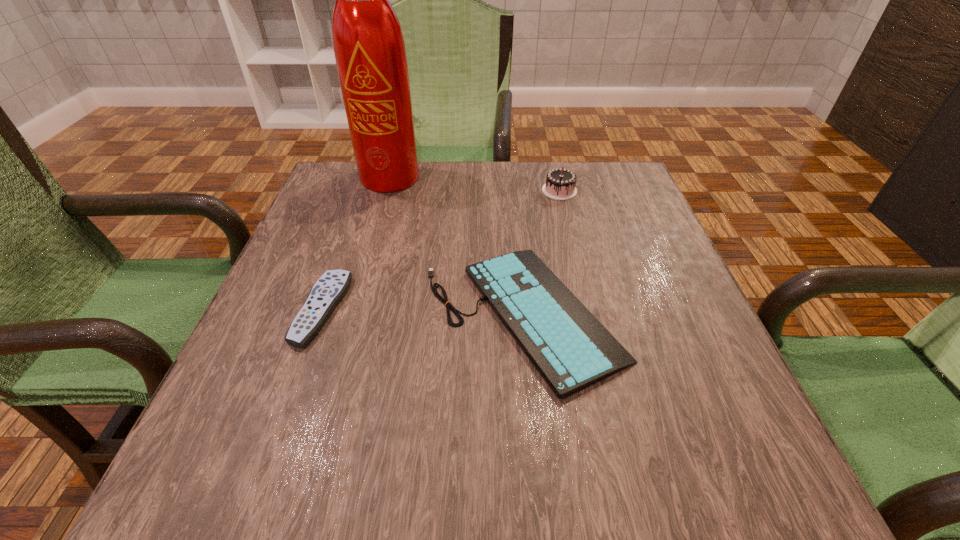
Where is `the tallest object`? This screenshot has width=960, height=540. the tallest object is located at coordinates [369, 48].

At what (x,y) coordinates should I click in order to perform the action: click on chocolate cake. Please return your answer as a coordinate pair (x, y). The width and height of the screenshot is (960, 540). Looking at the image, I should click on (560, 184).

Identify the location of computer keyboard. This screenshot has height=540, width=960. (571, 349).

Find the location of a particular element. This screenshot has height=540, width=960. remote control is located at coordinates (330, 288).

This screenshot has height=540, width=960. In order to click on blank space located on the front of the fire extinguisher in this screenshot , I will do `click(372, 256)`.

Where is `vacant space situated on the front of the third shortest object`? This screenshot has height=540, width=960. vacant space situated on the front of the third shortest object is located at coordinates (570, 234).

Where is `vacant space located on the back of the computer keyboard`? The height and width of the screenshot is (540, 960). vacant space located on the back of the computer keyboard is located at coordinates (508, 161).

This screenshot has width=960, height=540. Identify the location of vacant point located 0.380m on the back of the remote control. (368, 180).

Where is `fire extinguisher positioned at the far edge`? The height and width of the screenshot is (540, 960). fire extinguisher positioned at the far edge is located at coordinates (369, 48).

Identify the location of chocolate cake situated at the far edge. (560, 184).